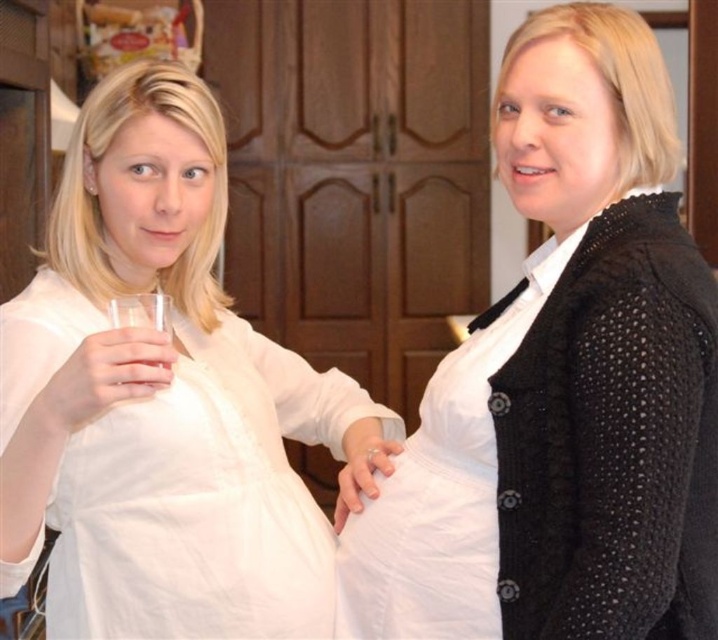
You are a photographer standing in the room and want to take a closeup shot of the white matte shirt at center. You are currently 33.24 inches away from it. Is this distance sufficient to capture the shirt in detail without any distortion?

The white matte shirt at center and viewer are 33.24 inches apart, so this distance is sufficient to capture the shirt in detail without distortion.

You are a delivery person trying to place a small package between the white matte shirt at center and the white cotton shirt at left. Can you fit the package if it measures 12 inches in length?

The distance between the white matte shirt at center and the white cotton shirt at left is 14.24 inches. Since the package is 12 inches long, it can fit between them as there is enough space.